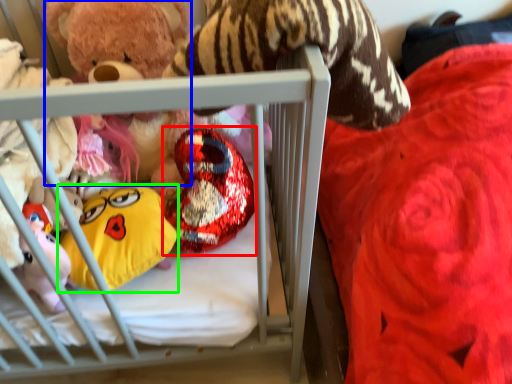
Question: Which object is positioned closest to toy (highlighted by a red box)? Select from toy (highlighted by a blue box) and toy (highlighted by a green box).

Choices:
 (A) toy
 (B) toy

Answer: (B)